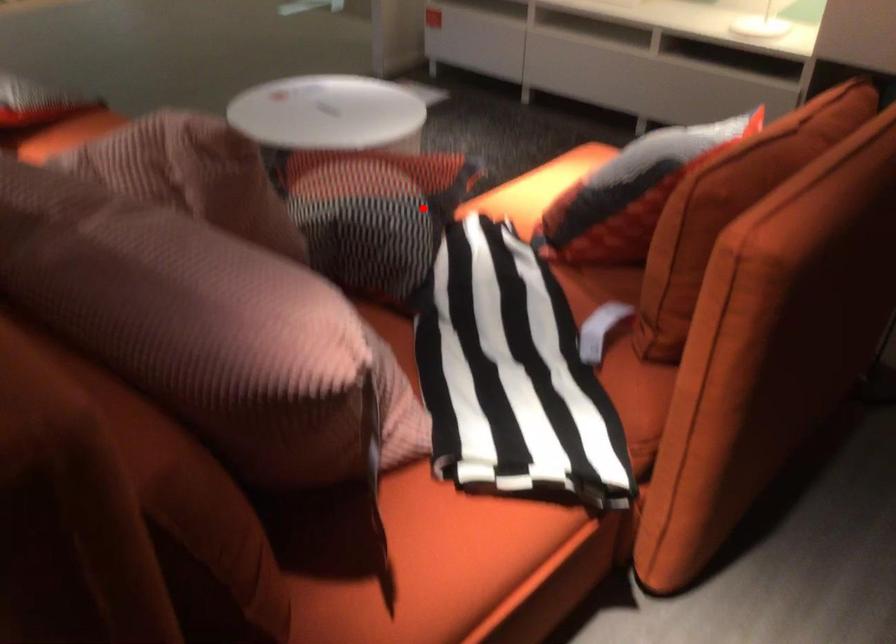
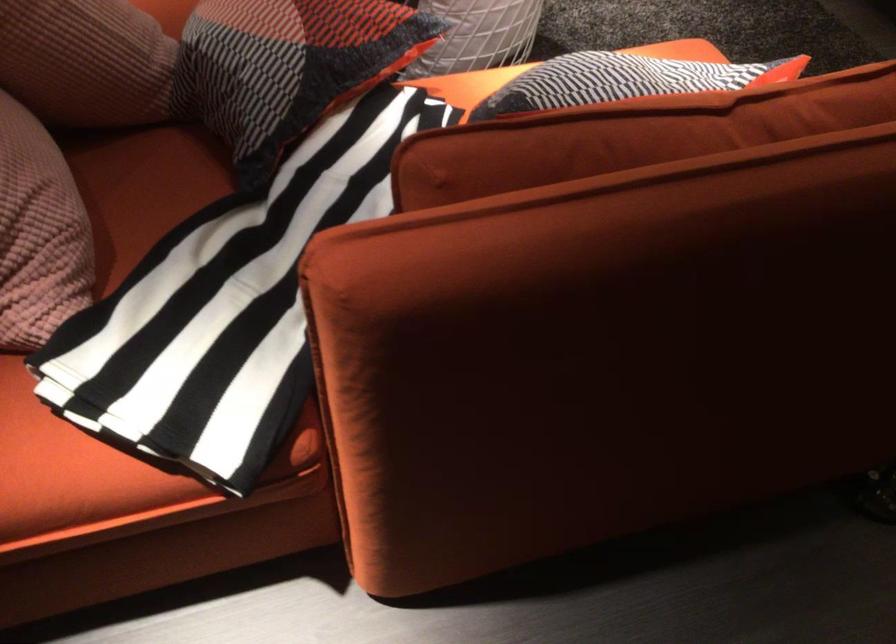
The point at the highlighted location is marked in the first image. Where is the corresponding point in the second image?

(288, 67)